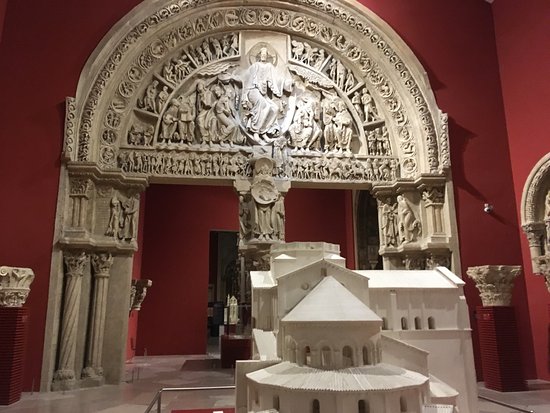
I want to click on red walls, so click(x=34, y=98), click(x=185, y=237), click(x=320, y=206), click(x=470, y=75).